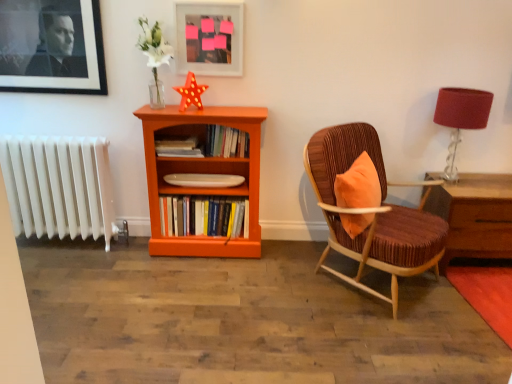
Question: Does matte white picture frame at upper center, the first picture frame positioned from the right, have a greater width compared to hardcover books at center, acting as the 1th book starting from the top?

Choices:
 (A) no
 (B) yes

Answer: (A)

Question: Would you consider matte white picture frame at upper center, the first picture frame positioned from the right, to be distant from hardcover books at center, acting as the 1th book starting from the top?

Choices:
 (A) yes
 (B) no

Answer: (B)

Question: Is hardcover books at center, acting as the 1th book starting from the top, located within matte white picture frame at upper center, the first picture frame positioned from the right?

Choices:
 (A) no
 (B) yes

Answer: (A)

Question: Is matte white picture frame at upper center, placed as the 2th picture frame when sorted from left to right, positioned before hardcover books at center, which is the third book from bottom to top?

Choices:
 (A) no
 (B) yes

Answer: (B)

Question: Is matte white picture frame at upper center, placed as the 2th picture frame when sorted from left to right, outside hardcover books at center, which is the third book from bottom to top?

Choices:
 (A) yes
 (B) no

Answer: (A)

Question: Considering the relative positions of hardcover books at center, the third book from the top, and hardcover books at center, which is the third book from bottom to top, in the image provided, is hardcover books at center, the third book from the top, to the left or to the right of hardcover books at center, which is the third book from bottom to top,?

Choices:
 (A) left
 (B) right

Answer: (A)

Question: Choose the correct answer: Is hardcover books at center, positioned as the first book in bottom-to-top order, inside hardcover books at center, which is the third book from bottom to top, or outside it?

Choices:
 (A) inside
 (B) outside

Answer: (B)

Question: From their relative heights in the image, would you say hardcover books at center, positioned as the first book in bottom-to-top order, is taller or shorter than hardcover books at center, which is the third book from bottom to top?

Choices:
 (A) short
 (B) tall

Answer: (B)

Question: In terms of width, does hardcover books at center, positioned as the first book in bottom-to-top order, look wider or thinner when compared to hardcover books at center, which is the third book from bottom to top?

Choices:
 (A) thin
 (B) wide

Answer: (B)

Question: Based on their sizes in the image, would you say hardcover books at center, positioned as the first book in bottom-to-top order, is bigger or smaller than orange wood bookcase at center?

Choices:
 (A) small
 (B) big

Answer: (A)

Question: Visually, is hardcover books at center, the third book from the top, positioned to the left or to the right of orange wood bookcase at center?

Choices:
 (A) right
 (B) left

Answer: (B)

Question: Is hardcover books at center, the third book from the top, situated inside orange wood bookcase at center or outside?

Choices:
 (A) outside
 (B) inside

Answer: (B)

Question: In terms of width, does hardcover books at center, the third book from the top, look wider or thinner when compared to orange wood bookcase at center?

Choices:
 (A) thin
 (B) wide

Answer: (A)

Question: Is point (69, 213) closer or farther from the camera than point (246, 226)?

Choices:
 (A) farther
 (B) closer

Answer: (A)

Question: In terms of width, does white plastic radiator at left look wider or thinner when compared to hardcover books at center, positioned as the first book in bottom-to-top order?

Choices:
 (A) thin
 (B) wide

Answer: (A)